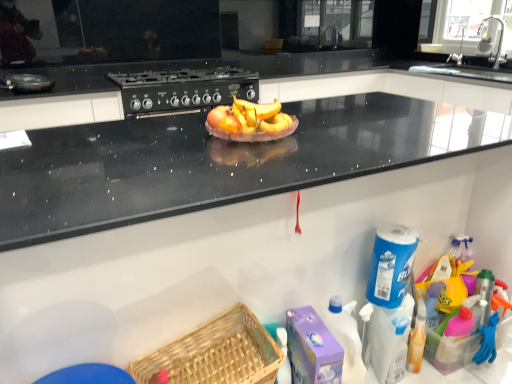
Question: From a real-world perspective, is black matte gas stove at upper center physically located above or below metallic faucet at upper right, placed as the 2th faucet when sorted from back to front?

Choices:
 (A) below
 (B) above

Answer: (A)

Question: In terms of height, does black matte gas stove at upper center look taller or shorter compared to metallic faucet at upper right, arranged as the first faucet when viewed from the front?

Choices:
 (A) tall
 (B) short

Answer: (B)

Question: Based on their relative distances, which object is nearer to the woven wood basket at lower center?

Choices:
 (A) black matte pan at upper left
 (B) metallic faucet at upper right, arranged as the first faucet when viewed from the front
 (C) yellow matte bananas at center
 (D) black matte gas stove at upper center
 (E) silver metallic faucet at upper right, placed as the 2th faucet when sorted from front to back

Answer: (C)

Question: Estimate the real-world distances between objects in this image. Which object is farther from the silver metallic faucet at upper right, placed as the 2th faucet when sorted from front to back?

Choices:
 (A) black matte gas stove at upper center
 (B) metallic faucet at upper right, placed as the 2th faucet when sorted from back to front
 (C) yellow matte bananas at center
 (D) woven wood basket at lower center
 (E) black matte pan at upper left

Answer: (D)